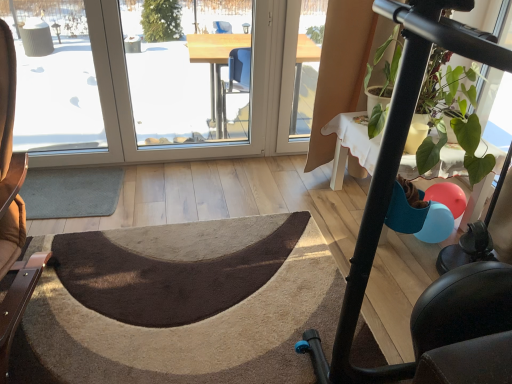
The image size is (512, 384). What do you see at coordinates (181, 304) in the screenshot?
I see `brown textured rug at center, which appears as the first doormat when ordered from the bottom` at bounding box center [181, 304].

What is the approximate height of brown textured rug at center, which appears as the first doormat when ordered from the bottom?

The height of brown textured rug at center, which appears as the first doormat when ordered from the bottom, is 1.63 inches.

In order to face white lace tablecloth at upper right, should I rotate leftwards or rightwards?

Turn right approximately 18.746 degrees to face it.

Locate an element on the screen. Image resolution: width=512 pixels, height=384 pixels. transparent glass window at upper left, the 1th window screen viewed from the left is located at coordinates (54, 77).

This screenshot has height=384, width=512. Describe the element at coordinates (71, 192) in the screenshot. I see `gray carpet at lower left, which is the first doormat in top-to-bottom order` at that location.

In order to face gray carpet at lower left, the second doormat ordered from the bottom, should I rotate leftwards or rightwards?

It's best to rotate left around 23.835 degrees.

Measure the distance between point (12, 227) and camera.

Point (12, 227) is 1.73 meters away from camera.

Locate an element on the screen. Image resolution: width=512 pixels, height=384 pixels. transparent glass window at center, marked as the 1th window screen in a right-to-left arrangement is located at coordinates (189, 70).

Locate an element on the screen. The image size is (512, 384). brown textured rug at center, which appears as the first doormat when ordered from the bottom is located at coordinates coord(181,304).

Would you say transparent glass window at center, marked as the second window screen in a left-to-right arrangement, is to the left or to the right of gray carpet at lower left, which is the first doormat in top-to-bottom order, in the picture?

From the image, it's evident that transparent glass window at center, marked as the second window screen in a left-to-right arrangement, is to the right of gray carpet at lower left, which is the first doormat in top-to-bottom order.

Could you tell me if transparent glass window at center, marked as the 1th window screen in a right-to-left arrangement, is turned towards gray carpet at lower left, the second doormat ordered from the bottom?

No, transparent glass window at center, marked as the 1th window screen in a right-to-left arrangement, is not oriented towards gray carpet at lower left, the second doormat ordered from the bottom.

Considering the points (164, 80) and (60, 203), which point is in front, point (164, 80) or point (60, 203)?

The point (60, 203) is closer to the camera.

From the image's perspective, is transparent glass window at center, marked as the second window screen in a left-to-right arrangement, positioned above or below gray carpet at lower left, which is the first doormat in top-to-bottom order?

From the image's perspective, transparent glass window at center, marked as the second window screen in a left-to-right arrangement, appears above gray carpet at lower left, which is the first doormat in top-to-bottom order.

From a real-world perspective, is white lace tablecloth at upper right on top of transparent glass window at center, marked as the second window screen in a left-to-right arrangement?

No.

Locate an element on the screen. Image resolution: width=512 pixels, height=384 pixels. table that is below the transparent glass window at center, marked as the 1th window screen in a right-to-left arrangement (from the image's perspective) is located at coordinates (355, 139).

Consider the image. Is white lace tablecloth at upper right turned away from transparent glass window at center, marked as the 1th window screen in a right-to-left arrangement?

No, white lace tablecloth at upper right's orientation is not away from transparent glass window at center, marked as the 1th window screen in a right-to-left arrangement.

Does white lace tablecloth at upper right touch transparent glass window at center, marked as the second window screen in a left-to-right arrangement?

white lace tablecloth at upper right is not next to transparent glass window at center, marked as the second window screen in a left-to-right arrangement, and they're not touching.

Between brown textured rug at center, which appears as the 2th doormat when viewed from the top, and green matte plant at right, which one has less height?

With less height is brown textured rug at center, which appears as the 2th doormat when viewed from the top.

Which object is wider, brown textured rug at center, which appears as the 2th doormat when viewed from the top, or green matte plant at right?

With larger width is brown textured rug at center, which appears as the 2th doormat when viewed from the top.

Would you say brown textured rug at center, which appears as the 2th doormat when viewed from the top, contains green matte plant at right?

No, green matte plant at right is not a part of brown textured rug at center, which appears as the 2th doormat when viewed from the top.

Which object is positioned more to the right, brown leather chair at left or white lace tablecloth at upper right?

From the viewer's perspective, white lace tablecloth at upper right appears more on the right side.

Looking at the image, does brown leather chair at left seem bigger or smaller compared to white lace tablecloth at upper right?

Considering their sizes, brown leather chair at left takes up more space than white lace tablecloth at upper right.

Who is shorter, brown leather chair at left or white lace tablecloth at upper right?

With less height is white lace tablecloth at upper right.

Considering the relative sizes of brown leather chair at left and white lace tablecloth at upper right in the image provided, is brown leather chair at left thinner than white lace tablecloth at upper right?

Incorrect, the width of brown leather chair at left is not less than that of white lace tablecloth at upper right.

Between transparent glass window at center, marked as the 1th window screen in a right-to-left arrangement, and white lace tablecloth at upper right, which one has smaller width?

With smaller width is transparent glass window at center, marked as the 1th window screen in a right-to-left arrangement.

Based on the photo, do you think transparent glass window at center, marked as the 1th window screen in a right-to-left arrangement, is within white lace tablecloth at upper right, or outside of it?

transparent glass window at center, marked as the 1th window screen in a right-to-left arrangement, is outside white lace tablecloth at upper right.

Based on the photo, from a real-world perspective, between transparent glass window at center, marked as the 1th window screen in a right-to-left arrangement, and white lace tablecloth at upper right, who is vertically lower?

white lace tablecloth at upper right.

Can you tell me how much transparent glass window at center, marked as the second window screen in a left-to-right arrangement, and white lace tablecloth at upper right differ in facing direction?

The angular difference between transparent glass window at center, marked as the second window screen in a left-to-right arrangement, and white lace tablecloth at upper right is 90 degrees.

Is brown textured rug at center, which appears as the 2th doormat when viewed from the top, positioned far away from transparent glass window at center, marked as the second window screen in a left-to-right arrangement?

Yes, brown textured rug at center, which appears as the 2th doormat when viewed from the top, and transparent glass window at center, marked as the second window screen in a left-to-right arrangement, are located far from each other.

Can you confirm if brown textured rug at center, which appears as the 2th doormat when viewed from the top, is shorter than transparent glass window at center, marked as the 1th window screen in a right-to-left arrangement?

Yes, brown textured rug at center, which appears as the 2th doormat when viewed from the top, is shorter than transparent glass window at center, marked as the 1th window screen in a right-to-left arrangement.

Measure the distance from brown textured rug at center, which appears as the first doormat when ordered from the bottom, to transparent glass window at center, marked as the 1th window screen in a right-to-left arrangement.

They are 3.86 feet apart.

Is brown textured rug at center, which appears as the first doormat when ordered from the bottom, closer to camera compared to transparent glass window at center, marked as the second window screen in a left-to-right arrangement?

Yes, it is in front of transparent glass window at center, marked as the second window screen in a left-to-right arrangement.

Can you tell me how much transparent glass window at upper left, the 1th window screen viewed from the left, and brown textured rug at center, which appears as the first doormat when ordered from the bottom, differ in facing direction?

They differ by 18.1 degrees in their facing directions.

Which is closer, (37, 31) or (268, 380)?

Point (37, 31) appears to be farther away from the viewer than point (268, 380).

From the image's perspective, which object appears higher, transparent glass window at upper left, the 1th window screen viewed from the left, or brown textured rug at center, which appears as the first doormat when ordered from the bottom?

transparent glass window at upper left, the 1th window screen viewed from the left, is shown above in the image.

Based on their sizes in the image, would you say transparent glass window at upper left, the 1th window screen viewed from the left, is bigger or smaller than brown textured rug at center, which appears as the 2th doormat when viewed from the top?

transparent glass window at upper left, the 1th window screen viewed from the left, is smaller than brown textured rug at center, which appears as the 2th doormat when viewed from the top.

Find the location of a particular element. the 2nd doormat to the left when counting from the transparent glass window at center, marked as the second window screen in a left-to-right arrangement is located at coordinates (71, 192).

The width and height of the screenshot is (512, 384). In order to click on table directly beneath the transparent glass window at center, marked as the 1th window screen in a right-to-left arrangement (from a real-world perspective) in this screenshot , I will do `click(355, 139)`.

Based on their spatial positions, is brown textured rug at center, which appears as the 2th doormat when viewed from the top, or white lace tablecloth at upper right closer to transparent glass window at center, marked as the 1th window screen in a right-to-left arrangement?

Among the two, white lace tablecloth at upper right is located nearer to transparent glass window at center, marked as the 1th window screen in a right-to-left arrangement.

Looking at the image, which one is located further to transparent glass window at upper left, the 1th window screen viewed from the left, brown textured rug at center, which appears as the first doormat when ordered from the bottom, or green matte plant at right?

green matte plant at right is positioned further to the anchor transparent glass window at upper left, the 1th window screen viewed from the left.

Based on their spatial positions, is green matte plant at right or brown leather chair at left further from gray carpet at lower left, which is the first doormat in top-to-bottom order?

Based on the image, green matte plant at right appears to be further to gray carpet at lower left, which is the first doormat in top-to-bottom order.

From the image, which object appears to be farther from white lace tablecloth at upper right, transparent glass window at center, marked as the second window screen in a left-to-right arrangement, or brown leather chair at left?

brown leather chair at left lies further to white lace tablecloth at upper right than the other object.

Looking at this image, from the image, which object appears to be nearer to white lace tablecloth at upper right, transparent glass window at upper left, the 1th window screen viewed from the left, or gray carpet at lower left, which is the first doormat in top-to-bottom order?

Among the two, gray carpet at lower left, which is the first doormat in top-to-bottom order, is located nearer to white lace tablecloth at upper right.

Based on their spatial positions, is green matte plant at right or gray carpet at lower left, the second doormat ordered from the bottom, further from brown textured rug at center, which appears as the 2th doormat when viewed from the top?

Among the two, green matte plant at right is located further to brown textured rug at center, which appears as the 2th doormat when viewed from the top.

Looking at the image, which one is located closer to white lace tablecloth at upper right, transparent glass window at upper left, the second window screen positioned from the right, or green matte plant at right?

Among the two, green matte plant at right is located nearer to white lace tablecloth at upper right.

From the image, which object appears to be farther from transparent glass window at center, marked as the second window screen in a left-to-right arrangement, white lace tablecloth at upper right or transparent glass window at upper left, the second window screen positioned from the right?

white lace tablecloth at upper right.

The image size is (512, 384). Find the location of `window screen located between gray carpet at lower left, which is the first doormat in top-to-bottom order, and white lace tablecloth at upper right in the left-right direction`. window screen located between gray carpet at lower left, which is the first doormat in top-to-bottom order, and white lace tablecloth at upper right in the left-right direction is located at coordinates (189, 70).

I want to click on doormat between gray carpet at lower left, the second doormat ordered from the bottom, and green matte plant at right from left to right, so click(181, 304).

Find the location of a particular element. doormat between gray carpet at lower left, which is the first doormat in top-to-bottom order, and white lace tablecloth at upper right, in the horizontal direction is located at coordinates (181, 304).

At what (x,y) coordinates should I click in order to perform the action: click on chair between transparent glass window at upper left, the 1th window screen viewed from the left, and white lace tablecloth at upper right, in the horizontal direction. Please return your answer as a coordinate pair (x, y). The width and height of the screenshot is (512, 384). Looking at the image, I should click on (12, 210).